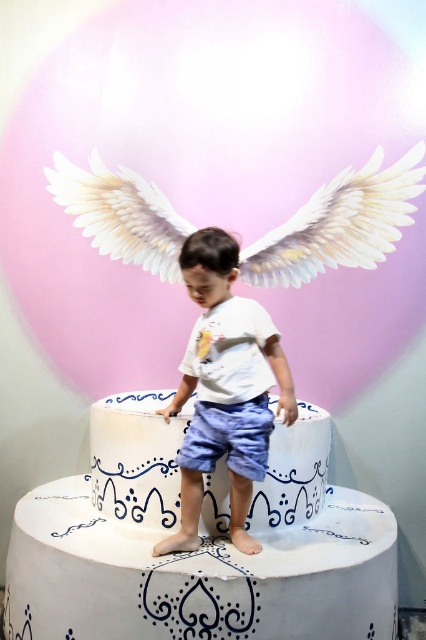
Question: Estimate the real-world distances between objects in this image. Which object is closer to the white painted cake at center?

Choices:
 (A) white cotton shirt at center
 (B) white glossy cake at center

Answer: (B)

Question: Is white painted cake at center wider than white cotton shirt at center?

Choices:
 (A) yes
 (B) no

Answer: (A)

Question: Among these objects, which one is farthest from the camera?

Choices:
 (A) white painted cake at center
 (B) white cotton shirt at center

Answer: (B)

Question: Does white cotton shirt at center have a lesser width compared to white glossy cake at center?

Choices:
 (A) no
 (B) yes

Answer: (B)

Question: Estimate the real-world distances between objects in this image. Which object is farther from the white feathered wings at upper center?

Choices:
 (A) white painted cake at center
 (B) white glossy cake at center

Answer: (A)

Question: Is white feathered wings at upper center positioned behind white cotton shirt at center?

Choices:
 (A) yes
 (B) no

Answer: (A)